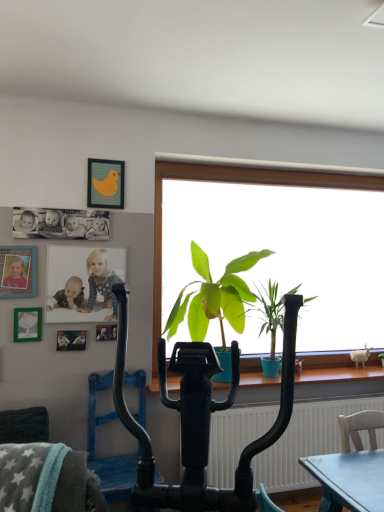
Question: Is metallic silver photo frame at upper left, the first picture frame positioned from the right, in front of or behind gray plush swivel chair at lower left in the image?

Choices:
 (A) behind
 (B) front

Answer: (A)

Question: From a real-world perspective, relative to gray plush swivel chair at lower left, is metallic silver photo frame at upper left, the first picture frame positioned from the right, vertically above or below?

Choices:
 (A) below
 (B) above

Answer: (B)

Question: Based on their relative distances, which object is nearer to the green matte plant at center, acting as the second houseplant starting from the right?

Choices:
 (A) gray plush swivel chair at lower left
 (B) metallic silver picture frame at left, the 2th picture frame viewed from the left
 (C) matte yellow bird at upper center, which appears as the fifth picture frame when ordered from the bottom
 (D) black matte photograph at upper left
 (E) matte white photo of children at upper left

Answer: (E)

Question: Estimate the real-world distances between objects in this image. Which object is farther from the black matte photograph at upper left?

Choices:
 (A) matte yellow bird at upper center, which appears as the fifth picture frame when ordered from the bottom
 (B) metallic silver photo frame at upper left, arranged as the first picture frame when ordered from the bottom
 (C) metallic silver picture frame at left, the third picture frame positioned from the top
 (D) matte plastic picture frame at left, which appears as the fifth picture frame when viewed from the right
 (E) metallic silver photo frame at upper left, the fifth picture frame in the left-to-right sequence

Answer: (E)